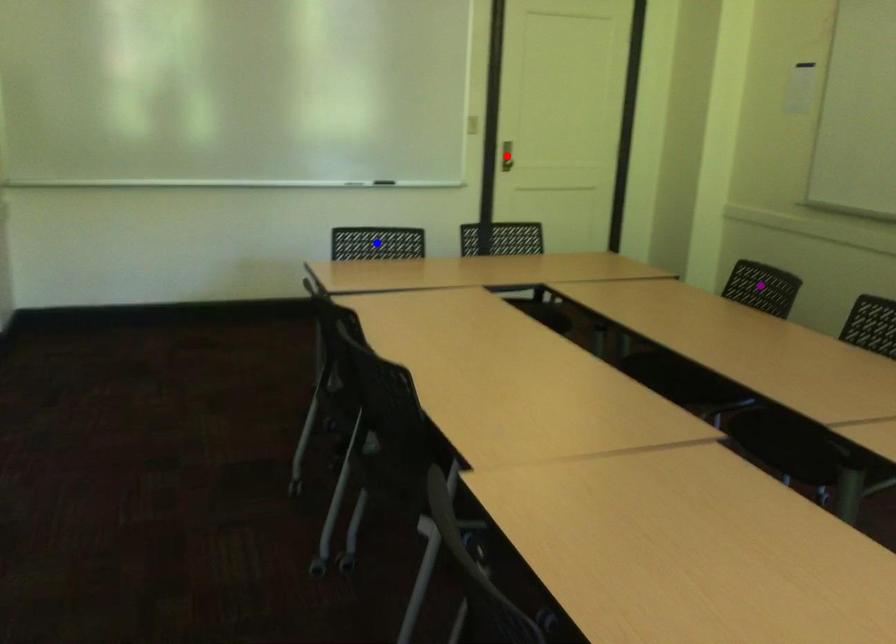
Order these from nearest to farthest:
red point, blue point, purple point

purple point < blue point < red point